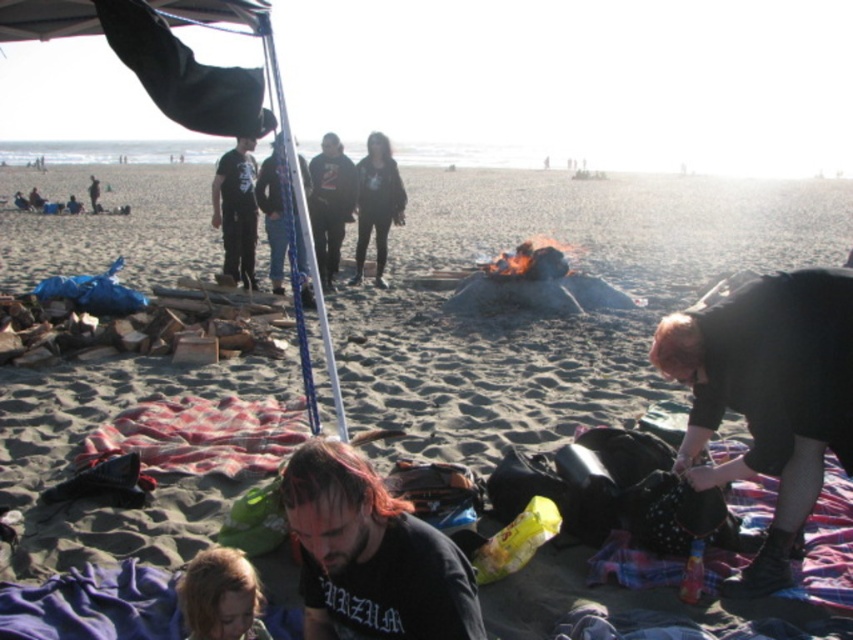
Question: Based on their relative distances, which object is nearer to the black cotton shirt at center?

Choices:
 (A) black matte jacket at center
 (B) dark blue jeans at center

Answer: (B)

Question: Can you confirm if dark brown hair at center is positioned to the right of black cotton shirt at center?

Choices:
 (A) yes
 (B) no

Answer: (A)

Question: Does black cotton shirt at center have a smaller size compared to dark blue jeans at center?

Choices:
 (A) yes
 (B) no

Answer: (A)

Question: Estimate the real-world distances between objects in this image. Which object is farther from the dark brown hair at center?

Choices:
 (A) blonde hair at lower left
 (B) dark blue jeans at center
 (C) dark gray hoodie at center

Answer: (C)

Question: Is black matte jacket at lower right smaller than black matte jacket at center?

Choices:
 (A) yes
 (B) no

Answer: (A)

Question: Which point is farther from the camera taking this photo?

Choices:
 (A) (357, 173)
 (B) (227, 589)

Answer: (A)